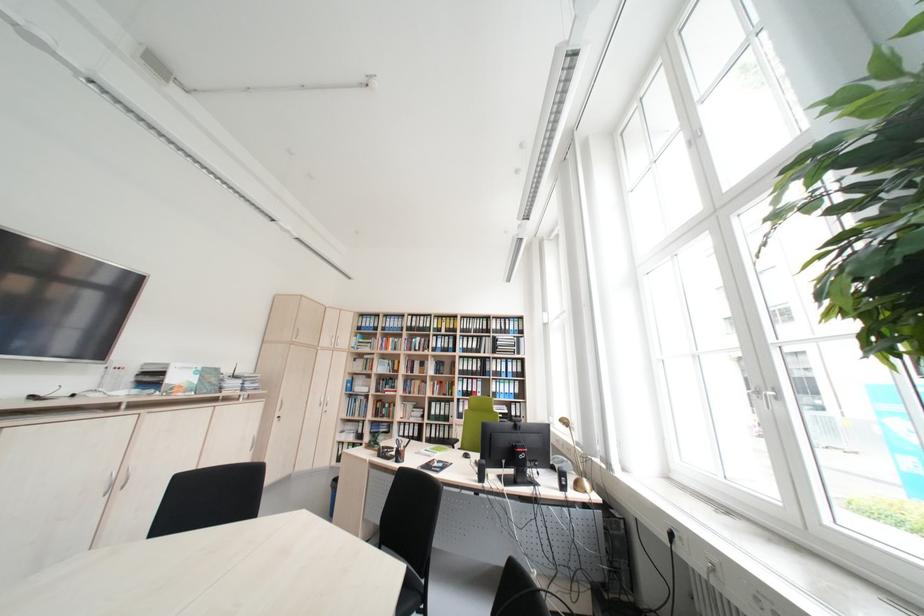
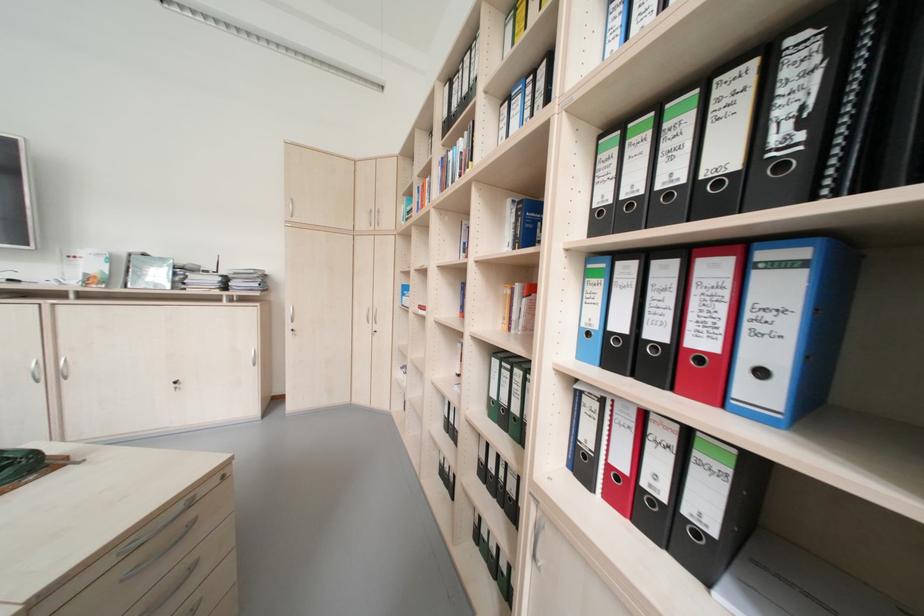
In the second image, find the point that corresponds to pixel 490 384 in the first image.

(793, 290)